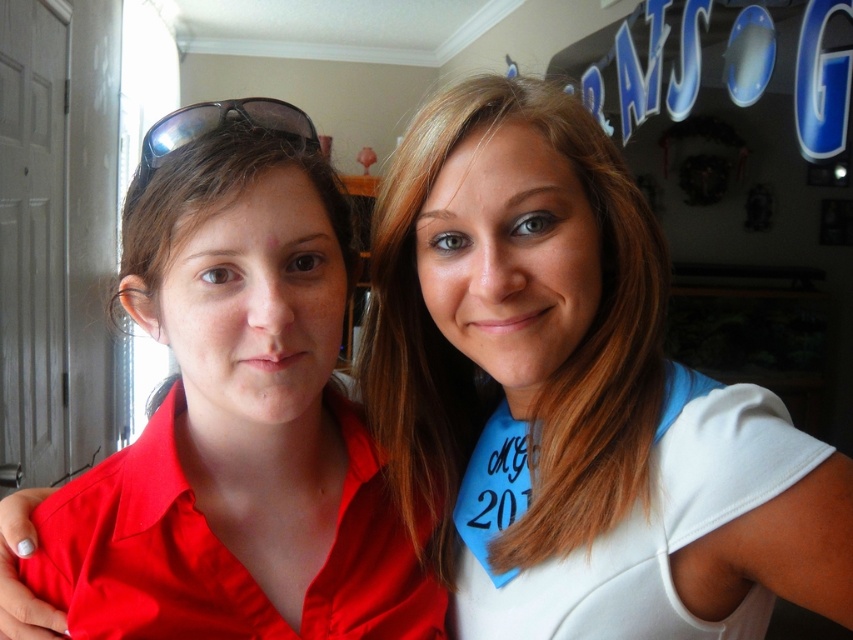
You are a photographer holding a camera that has a 10 inch minimum focus distance. You are positioned in front of the two people in the image. Can you take a clear photo of both the white matte shirt at upper right and the sunglasses at left at the same time without moving the camera?

The white matte shirt at upper right is 9.96 inches away from the sunglasses at left. Since the distance between them is less than the camera minimum focus distance of 10 inches, you cannot take a clear photo of both at the same time without moving the camera.

You are organizing a photo shoot and need to ensure that the matte red shirt at left and the sunglasses at left are visible in the frame. Based on their positions, which object should you adjust first to avoid being cut off if the frame is too narrow?

The sunglasses at left should be adjusted first since the matte red shirt at left is positioned on the left side of the sunglasses at left, meaning the shirt is closer to the edge of the frame. Adjusting the shirt first might still leave the sunglasses at risk of being cut off if the frame is narrow.

You are a photographer standing 10 feet away from the two people in the image. You want to take a photo of both the white matte shirt at upper right and the matte red shirt at left in the same frame. Based on their current positions, will you be able to capture both shirts in a single photo without moving the subjects?

The white matte shirt at upper right and the matte red shirt at left are 5.33 inches apart. Since the photographer is 10 feet away, the distance between them is likely within the camera frame, so both shirts can be captured in a single photo without moving the subjects.